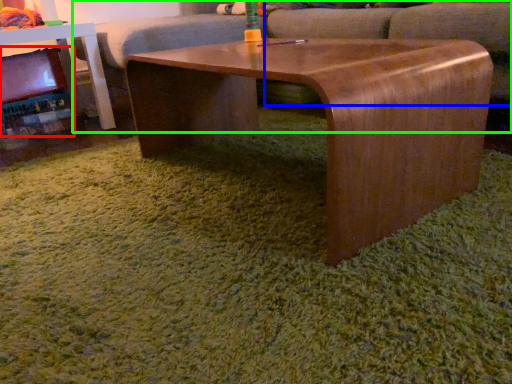
Question: Considering the real-world distances, which object is farthest from fireplace (highlighted by a red box)? swivel chair (highlighted by a blue box) or couch (highlighted by a green box)?

Choices:
 (A) swivel chair
 (B) couch

Answer: (A)